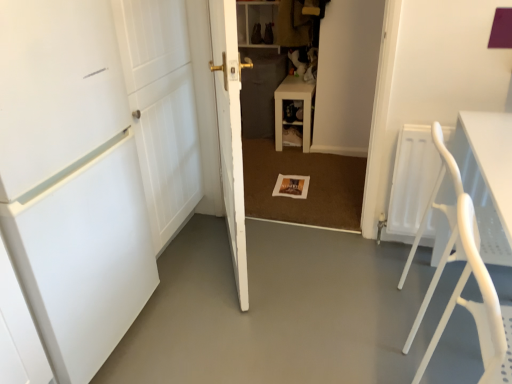
Question: Does smooth concrete floor at center have a larger size compared to white matte door at left, the second door in the right-to-left sequence?

Choices:
 (A) yes
 (B) no

Answer: (B)

Question: Considering the relative sizes of smooth concrete floor at center and white matte door at left, the second door in the right-to-left sequence, in the image provided, is smooth concrete floor at center shorter than white matte door at left, the second door in the right-to-left sequence,?

Choices:
 (A) yes
 (B) no

Answer: (A)

Question: Is smooth concrete floor at center far from white matte door at left, which is the 1th door in left-to-right order?

Choices:
 (A) yes
 (B) no

Answer: (B)

Question: Is smooth concrete floor at center closer to camera compared to white matte door at left, the second door in the right-to-left sequence?

Choices:
 (A) no
 (B) yes

Answer: (A)

Question: Considering the relative sizes of smooth concrete floor at center and white matte door at left, which is the 1th door in left-to-right order, in the image provided, is smooth concrete floor at center wider than white matte door at left, which is the 1th door in left-to-right order,?

Choices:
 (A) no
 (B) yes

Answer: (B)

Question: Is smooth concrete floor at center directly adjacent to white matte door at left, the second door in the right-to-left sequence?

Choices:
 (A) no
 (B) yes

Answer: (A)

Question: Can you see white plastic folding chair at right touching smooth concrete floor at center?

Choices:
 (A) no
 (B) yes

Answer: (A)

Question: Is white plastic folding chair at right thinner than smooth concrete floor at center?

Choices:
 (A) no
 (B) yes

Answer: (B)

Question: Does white plastic folding chair at right have a lesser height compared to smooth concrete floor at center?

Choices:
 (A) yes
 (B) no

Answer: (B)

Question: From the image's perspective, does white plastic folding chair at right appear higher than smooth concrete floor at center?

Choices:
 (A) no
 (B) yes

Answer: (B)

Question: Would you consider white plastic folding chair at right to be distant from smooth concrete floor at center?

Choices:
 (A) yes
 (B) no

Answer: (B)

Question: Is white plastic folding chair at right facing towards smooth concrete floor at center?

Choices:
 (A) no
 (B) yes

Answer: (A)

Question: Considering the relative positions of wooden shelf at center and smooth concrete floor at center in the image provided, is wooden shelf at center to the left of smooth concrete floor at center from the viewer's perspective?

Choices:
 (A) no
 (B) yes

Answer: (A)